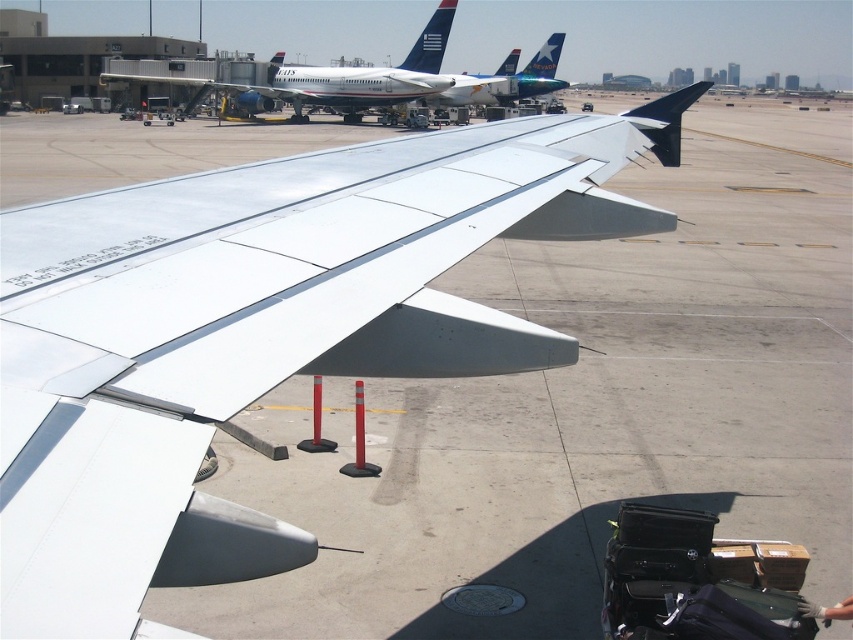
Which is behind, point (676, 548) or point (535, 90)?

Positioned behind is point (535, 90).

Which of these two, black hardshell suitcase at lower right or metallic blue airplane at upper center, stands shorter?

black hardshell suitcase at lower right

Does point (618, 545) come closer to viewer compared to point (541, 51)?

Yes, it is in front of point (541, 51).

Identify the location of black hardshell suitcase at lower right. This screenshot has width=853, height=640. (698, 580).

Is white matte airplane at upper center positioned before metallic blue airplane at upper center?

Yes, white matte airplane at upper center is closer to the viewer.

Describe the element at coordinates (334, 77) in the screenshot. I see `white matte airplane at upper center` at that location.

The image size is (853, 640). I want to click on white matte airplane at upper center, so click(x=334, y=77).

Is white matte wing at center to the left of metallic blue airplane at upper center from the viewer's perspective?

Correct, you'll find white matte wing at center to the left of metallic blue airplane at upper center.

Looking at this image, which is more to the left, white matte wing at center or metallic blue airplane at upper center?

Positioned to the left is white matte wing at center.

At what (x,y) coordinates should I click in order to perform the action: click on white matte wing at center. Please return your answer as a coordinate pair (x, y). The width and height of the screenshot is (853, 640). Looking at the image, I should click on (256, 333).